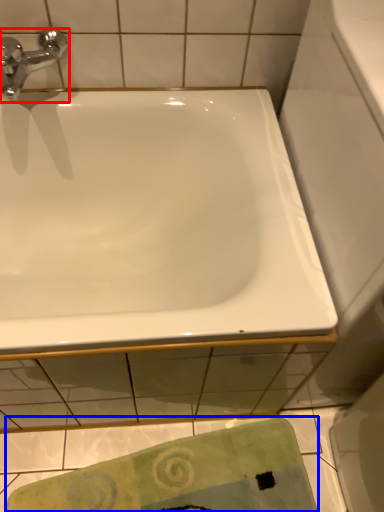
Question: Among these objects, which one is nearest to the camera, tap (highlighted by a red box) or beach towel (highlighted by a blue box)?

Choices:
 (A) tap
 (B) beach towel

Answer: (A)